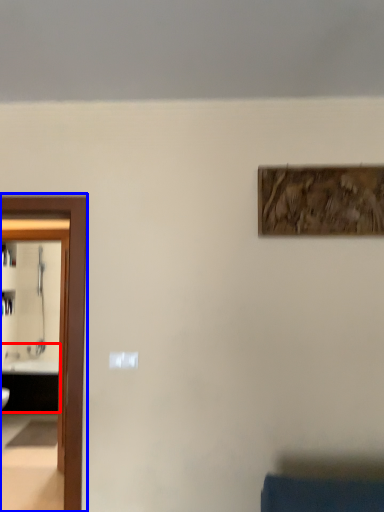
Question: Which point is further to the camera, sink (highlighted by a red box) or elevator (highlighted by a blue box)?

Choices:
 (A) sink
 (B) elevator

Answer: (A)